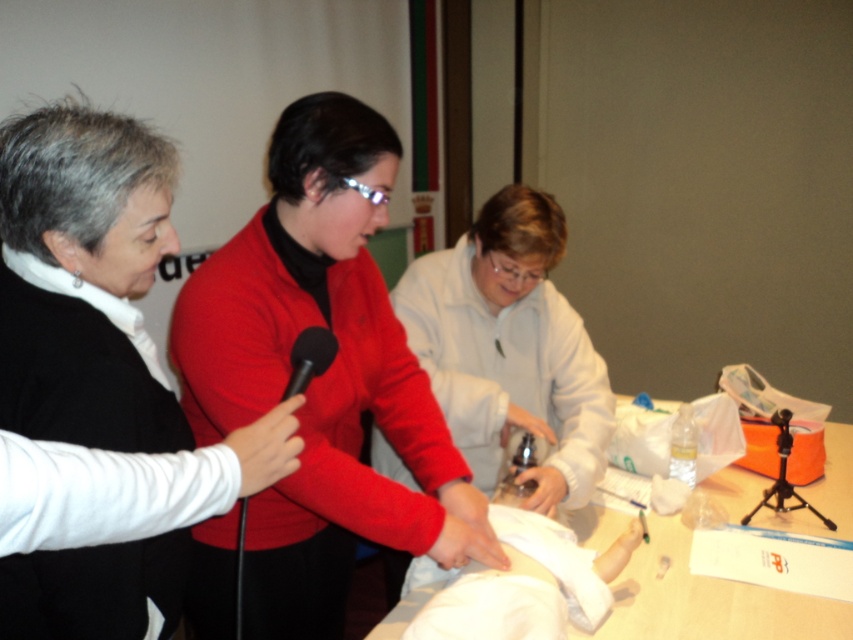
Between matte red sweater at center and matte black jacket at left, which one is positioned higher?

matte black jacket at left

Can you confirm if matte red sweater at center is smaller than matte black jacket at left?

No, matte red sweater at center is not smaller than matte black jacket at left.

Does point (305, 400) lie behind point (114, 568)?

Yes, point (305, 400) is farther from viewer.

I want to click on matte red sweater at center, so click(x=321, y=376).

Which is more to the right, matte red sweater at center or black matte microphone at center?

matte red sweater at center

Does matte red sweater at center have a larger size compared to black matte microphone at center?

Indeed, matte red sweater at center has a larger size compared to black matte microphone at center.

Is point (247, 388) farther from camera compared to point (312, 340)?

Yes.

Identify the location of matte red sweater at center. (x=321, y=376).

Who is higher up, matte black jacket at left or black matte microphone at center?

black matte microphone at center

Find the location of `matte black jacket at left`. matte black jacket at left is located at coordinates (84, 280).